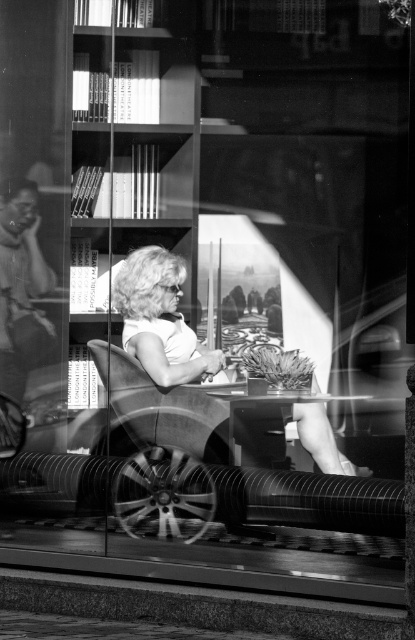
Describe the element at coordinates (243, 452) in the screenshot. I see `smooth wood park bench at center` at that location.

Can you confirm if smooth wood park bench at center is positioned to the left of white fabric chair at center?

No, smooth wood park bench at center is not to the left of white fabric chair at center.

Is point (275, 419) in front of point (187, 353)?

Yes, point (275, 419) is in front of point (187, 353).

I want to click on smooth wood park bench at center, so click(243, 452).